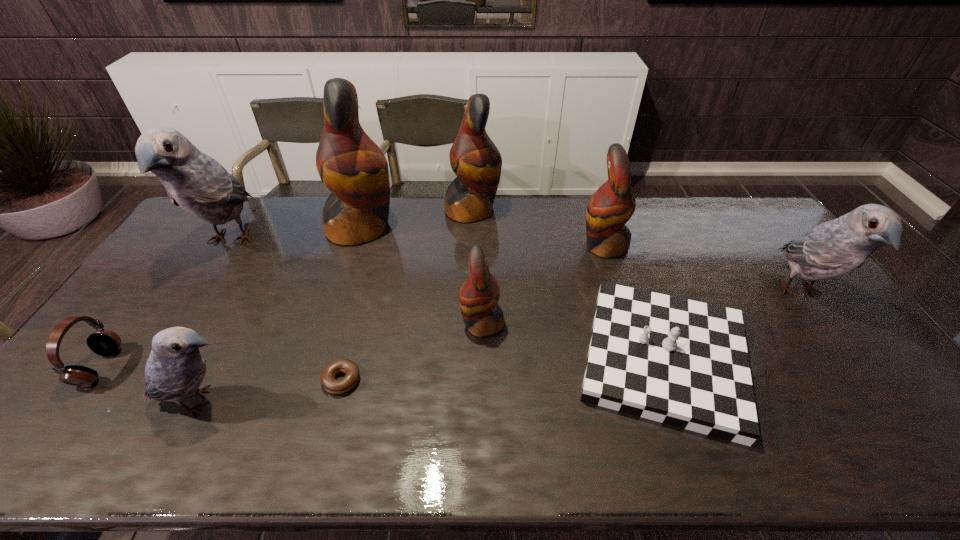
The height and width of the screenshot is (540, 960). Find the location of `vacant space in between the nearest parrot and the second smallest gray parrot`. vacant space in between the nearest parrot and the second smallest gray parrot is located at coordinates tap(500, 347).

This screenshot has width=960, height=540. Find the location of `vacant point located between the biggest gray parrot and the doughnut`. vacant point located between the biggest gray parrot and the doughnut is located at coordinates (286, 310).

Find the location of a particular element. This screenshot has width=960, height=540. empty space between the second parrot from right to left and the nearest gray parrot is located at coordinates pos(402,323).

At what (x,y) coordinates should I click in order to perform the action: click on free spot between the second smallest gray parrot and the second biggest red parrot. Please return your answer as a coordinate pair (x, y). The image size is (960, 540). Looking at the image, I should click on (636, 252).

Where is `vacant area that lies between the second smallest gray parrot and the smallest gray parrot`? This screenshot has height=540, width=960. vacant area that lies between the second smallest gray parrot and the smallest gray parrot is located at coordinates (500, 347).

At what (x,y) coordinates should I click in order to perform the action: click on empty space between the smallest red parrot and the biggest red parrot. Please return your answer as a coordinate pair (x, y). The height and width of the screenshot is (540, 960). Looking at the image, I should click on pos(421,276).

Image resolution: width=960 pixels, height=540 pixels. I want to click on vacant space that's between the biggest gray parrot and the nearest red parrot, so click(x=356, y=282).

What are the coordinates of `vacant area that lies between the second shortest object and the nearest parrot` in the screenshot? It's located at (432, 380).

The image size is (960, 540). Find the location of `free space between the headset and the checkerboard`. free space between the headset and the checkerboard is located at coordinates (381, 363).

Select which object is the second closest to the second biggest red parrot. Please provide its 2D coordinates. Your answer should be formatted as a tuple, i.e. [(x, y)], where the tuple contains the x and y coordinates of a point satisfying the conditions above.

[(610, 207)]